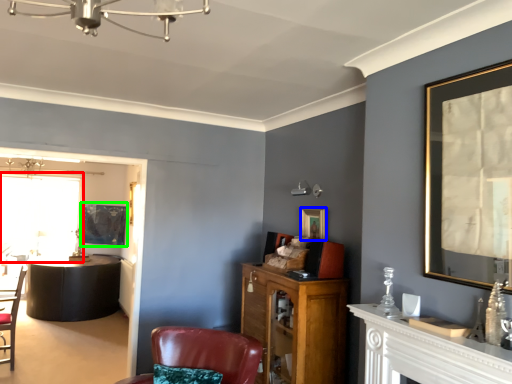
Question: Considering the real-world distances, which object is closest to window screen (highlighted by a red box)? picture frame (highlighted by a blue box) or picture frame (highlighted by a green box).

Choices:
 (A) picture frame
 (B) picture frame

Answer: (B)